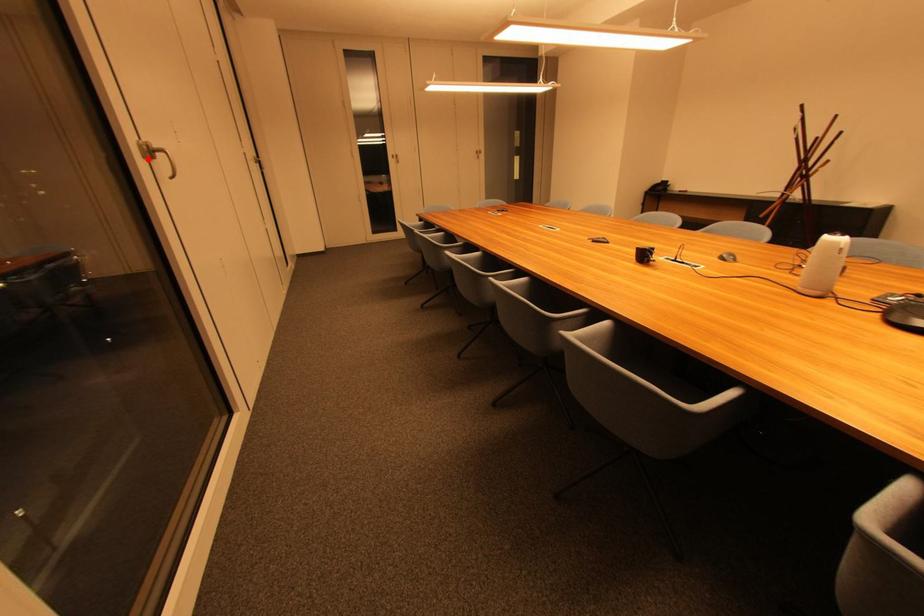
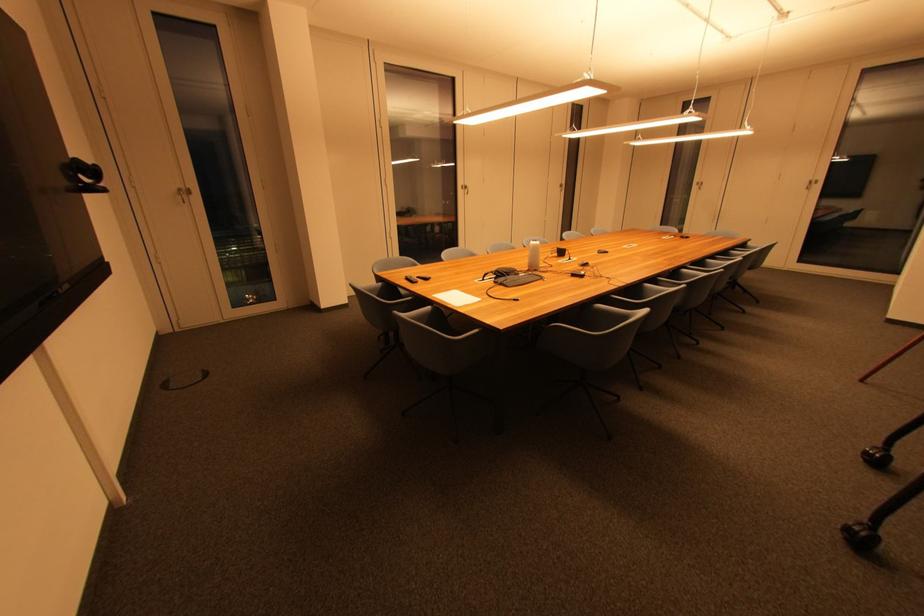
Question: A red point is marked in image1. In image2, is the corresponding 3D point closer to the camera or farther? Reply with the corresponding letter.

Choices:
 (A) The corresponding 3D point is closer.
 (B) The corresponding 3D point is farther.

Answer: (A)